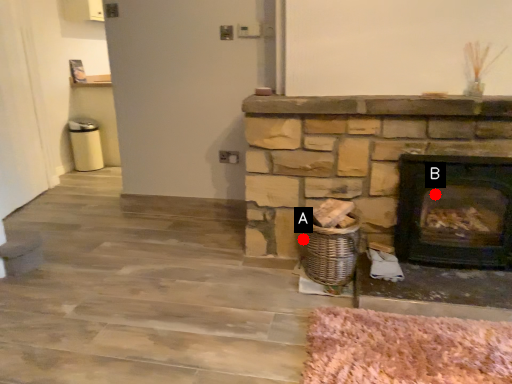
Question: Two points are circled on the image, labeled by A and B beside each circle. Which point is farther from the camera taking this photo?

Choices:
 (A) A is further
 (B) B is further

Answer: (B)